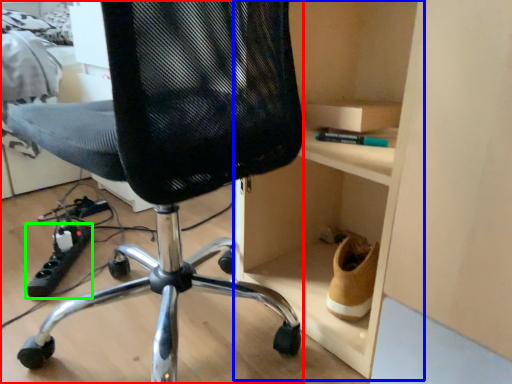
Question: Considering the real-world distances, which object is closest to chair (highlighted by a red box)? cabinet (highlighted by a blue box) or equipment (highlighted by a green box).

Choices:
 (A) cabinet
 (B) equipment

Answer: (A)